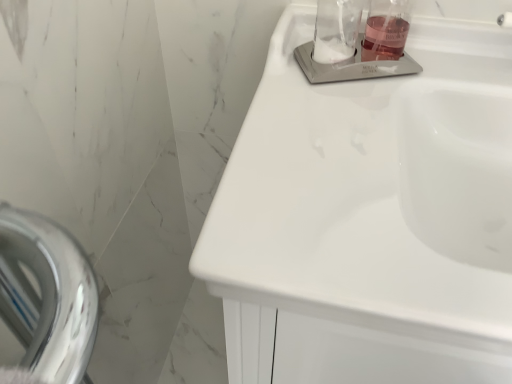
Find the location of a particular element. vacant area in front of clear glass soap dispenser at upper right, the 2th sink ordered from the bottom is located at coordinates (340, 126).